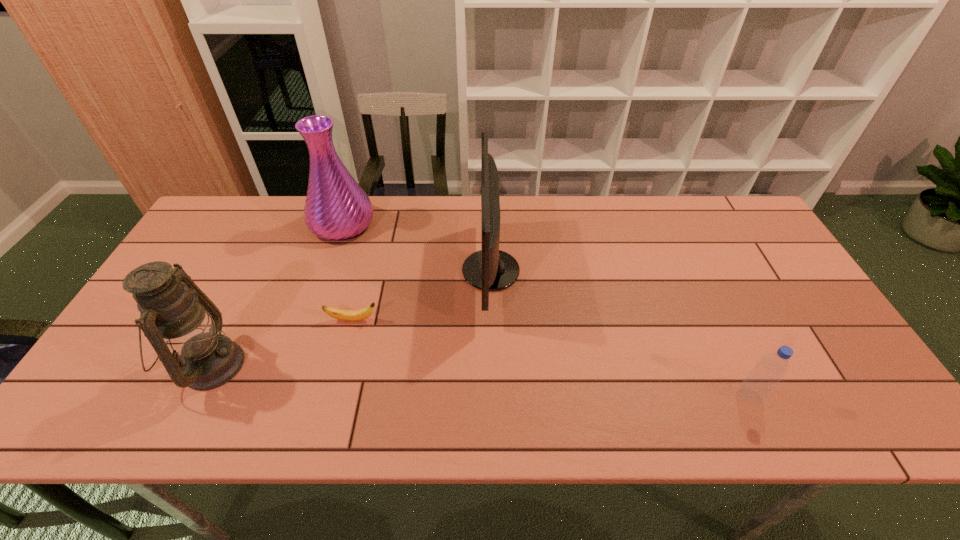
The width and height of the screenshot is (960, 540). Find the location of `free space between the monitor and the bottle`. free space between the monitor and the bottle is located at coordinates (620, 333).

Find the location of `free spot between the vase and the leftmost object`. free spot between the vase and the leftmost object is located at coordinates (276, 295).

Find the location of a particular element. Image resolution: width=960 pixels, height=540 pixels. vacant space that is in between the rightmost object and the monitor is located at coordinates (620, 333).

Locate an element on the screen. This screenshot has width=960, height=540. free spot between the shortest object and the vase is located at coordinates (348, 272).

You are a GUI agent. You are given a task and a screenshot of the screen. Output one action in this format:
    pyautogui.click(x=<x>, y=<y>)
    Task: Click on the free space between the banana and the monitor
    This screenshot has height=540, width=960.
    Given the screenshot: What is the action you would take?
    pyautogui.click(x=421, y=295)

Identify which object is located as the nearest to the leftmost object. Please provide its 2D coordinates. Your answer should be formatted as a tuple, i.e. [(x, y)], where the tuple contains the x and y coordinates of a point satisfying the conditions above.

[(346, 315)]

Locate which object ranks fourth in proximity to the vase. Please provide its 2D coordinates. Your answer should be formatted as a tuple, i.e. [(x, y)], where the tuple contains the x and y coordinates of a point satisfying the conditions above.

[(769, 371)]

The height and width of the screenshot is (540, 960). Identify the location of free space that satisfies the following two spatial constraints: 1. on the screen side of the rightmost object; 2. on the left side of the monitor. (493, 396).

Locate an element on the screen. This screenshot has height=540, width=960. vacant space that satisfies the following two spatial constraints: 1. on the back side of the bottle; 2. on the screen side of the monitor is located at coordinates (690, 271).

Image resolution: width=960 pixels, height=540 pixels. Identify the location of free spot that satisfies the following two spatial constraints: 1. on the screen side of the second shortest object; 2. on the right side of the monitor. (493, 396).